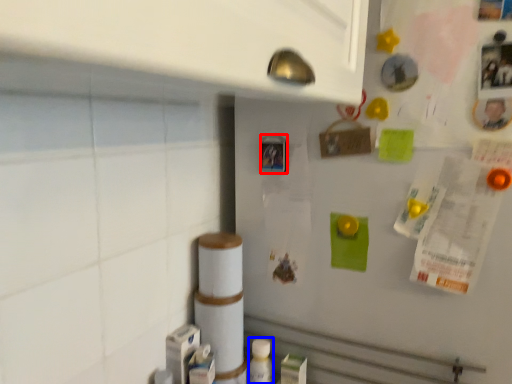
Question: Which object appears closest to the camera in this image, button (highlighted by a red box) or bottle (highlighted by a blue box)?

Choices:
 (A) button
 (B) bottle

Answer: (A)